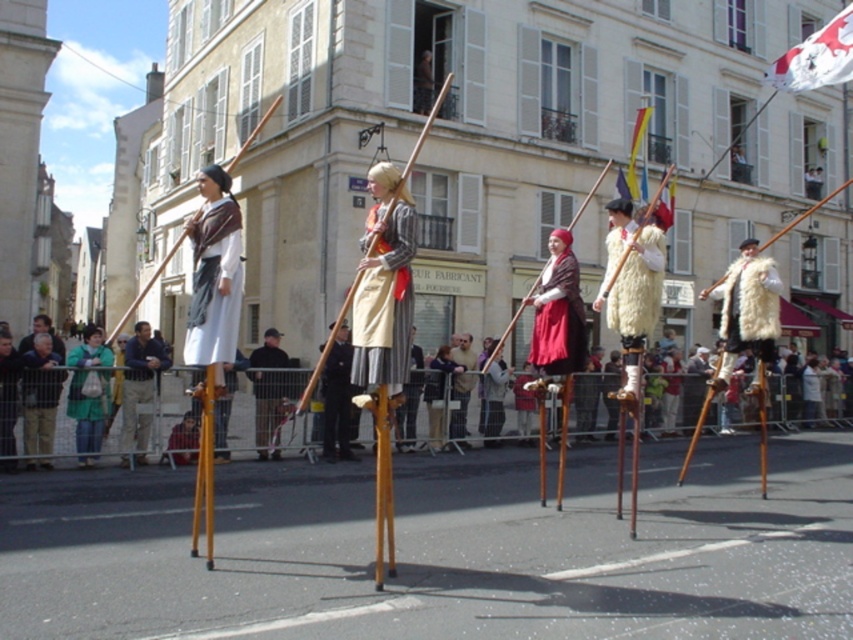
Does beige fabric skirt at center appear on the right side of white fabric flag at upper right?

In fact, beige fabric skirt at center is to the left of white fabric flag at upper right.

Find the location of a particular element. This screenshot has height=640, width=853. beige fabric skirt at center is located at coordinates (392, 305).

Does point (129, 388) come farther from viewer compared to point (328, 388)?

No, (129, 388) is in front of (328, 388).

How far apart are khaki pants at center and dark brown leather boots at center?

They are 7.34 feet apart.

Does point (129, 436) come behind point (340, 339)?

No, (129, 436) is closer to viewer.

At what (x,y) coordinates should I click in order to perform the action: click on khaki pants at center. Please return your answer as a coordinate pair (x, y). The height and width of the screenshot is (640, 853). Looking at the image, I should click on (138, 390).

Does matte brown wooden staff at center have a lesser width compared to multicolored fabric flag at center?

Correct, matte brown wooden staff at center's width is less than multicolored fabric flag at center's.

Is point (486, 376) in front of point (630, 177)?

That is True.

At what (x,y) coordinates should I click in order to perform the action: click on matte brown wooden staff at center. Please return your answer as a coordinate pair (x, y). This screenshot has width=853, height=640. Looking at the image, I should click on (492, 394).